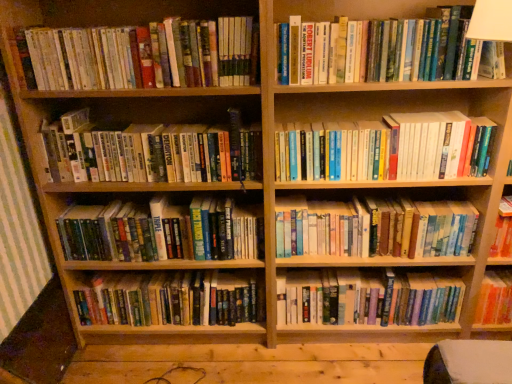
Image resolution: width=512 pixels, height=384 pixels. What do you see at coordinates (378, 50) in the screenshot? I see `hardcover book at upper right, which is counted as the 1th book, starting from the top` at bounding box center [378, 50].

The height and width of the screenshot is (384, 512). I want to click on hardcover books at upper left, which appears as the seventh book when ordered from the bottom, so pos(145,55).

The height and width of the screenshot is (384, 512). Identify the location of hardcover books at left, positioned as the sixth book in bottom-to-top order. (151, 152).

I want to click on hardcover books at center, which appears as the 7th book when viewed from the top, so click(367, 298).

The width and height of the screenshot is (512, 384). I want to click on hardcover book at upper right, which is counted as the 1th book, starting from the top, so click(378, 50).

Is the surface of hardcover books at center, positioned as the eighth book in top-to-bottom order, in direct contact with hardcover books at center, arranged as the 3th book when ordered from the bottom?

No, hardcover books at center, positioned as the eighth book in top-to-bottom order, is not in contact with hardcover books at center, arranged as the 3th book when ordered from the bottom.

Is hardcover books at center, positioned as the eighth book in top-to-bottom order, turned away from hardcover books at center, arranged as the 3th book when ordered from the bottom?

No, hardcover books at center, positioned as the eighth book in top-to-bottom order, is not facing the opposite direction of hardcover books at center, arranged as the 3th book when ordered from the bottom.

From the image's perspective, is hardcover books at center, positioned as the eighth book in top-to-bottom order, positioned above or below hardcover books at center, arranged as the 3th book when ordered from the bottom?

Based on their image positions, hardcover books at center, positioned as the eighth book in top-to-bottom order, is located beneath hardcover books at center, arranged as the 3th book when ordered from the bottom.

How far apart are hardcover books at center, positioned as the eighth book in top-to-bottom order, and hardcover books at center, arranged as the 3th book when ordered from the bottom?

hardcover books at center, positioned as the eighth book in top-to-bottom order, and hardcover books at center, arranged as the 3th book when ordered from the bottom, are 48.60 centimeters apart from each other.

Is point (488, 137) closer to camera compared to point (69, 220)?

Yes.

Is hardcover books at center, positioned as the fourth book in top-to-bottom order, aimed at hardcover book at center, which is the fourth book in bottom-to-top order?

No, hardcover books at center, positioned as the fourth book in top-to-bottom order, is not turned towards hardcover book at center, which is the fourth book in bottom-to-top order.

From a real-world perspective, between hardcover books at center, which appears as the fifth book when ordered from the bottom, and hardcover book at center, which is the fourth book in bottom-to-top order, who is vertically lower?

hardcover book at center, which is the fourth book in bottom-to-top order.

In the image, is hardcover books at center, which appears as the fifth book when ordered from the bottom, positioned in front of or behind hardcover book at center, positioned as the fifth book in top-to-bottom order?

hardcover books at center, which appears as the fifth book when ordered from the bottom, is in front of hardcover book at center, positioned as the fifth book in top-to-bottom order.

Considering the sizes of objects hardcover books at upper right and hardcover books at upper left, which appears as the seventh book when ordered from the bottom, in the image provided, who is thinner, hardcover books at upper right or hardcover books at upper left, which appears as the seventh book when ordered from the bottom,?

hardcover books at upper left, which appears as the seventh book when ordered from the bottom.

Would you say hardcover books at upper left, the second book from the top, is part of hardcover books at upper right's contents?

No, hardcover books at upper left, the second book from the top, is located outside of hardcover books at upper right.

Would you say hardcover books at upper right is a long distance from hardcover books at upper left, the second book from the top?

Result: Actually, hardcover books at upper right and hardcover books at upper left, the second book from the top, are a little close together.

Is hardcover book at upper right, the 8th book when ordered from bottom to top, at the back of hardcover book at center, positioned as the fifth book in top-to-bottom order?

hardcover book at center, positioned as the fifth book in top-to-bottom order, is not turned away from hardcover book at upper right, the 8th book when ordered from bottom to top.

From the image's perspective, relative to hardcover book at upper right, which is counted as the 1th book, starting from the top, is hardcover book at center, which is the fourth book in bottom-to-top order, above or below?

A: hardcover book at center, which is the fourth book in bottom-to-top order, is below hardcover book at upper right, which is counted as the 1th book, starting from the top.

Is hardcover book at center, positioned as the fifth book in top-to-bottom order, wider than hardcover book at upper right, the 8th book when ordered from bottom to top?

Indeed, hardcover book at center, positioned as the fifth book in top-to-bottom order, has a greater width compared to hardcover book at upper right, the 8th book when ordered from bottom to top.

From the image's perspective, between hardcover book at upper right, the 8th book when ordered from bottom to top, and hardcover books at upper right, which one is located above?

hardcover book at upper right, the 8th book when ordered from bottom to top.

From a real-world perspective, who is located higher, hardcover book at upper right, the 8th book when ordered from bottom to top, or hardcover books at upper right?

In real-world perspective, hardcover book at upper right, the 8th book when ordered from bottom to top, is above.

Considering the sizes of objects hardcover book at upper right, the 8th book when ordered from bottom to top, and hardcover books at upper right in the image provided, who is thinner, hardcover book at upper right, the 8th book when ordered from bottom to top, or hardcover books at upper right?

hardcover book at upper right, the 8th book when ordered from bottom to top, is thinner.

Can we say hardcover books at center, which appears as the 7th book when viewed from the top, lies outside hardcover books at center, arranged as the 3th book when ordered from the bottom?

That's correct, hardcover books at center, which appears as the 7th book when viewed from the top, is outside of hardcover books at center, arranged as the 3th book when ordered from the bottom.

Can you tell me how much hardcover books at center, which appears as the 7th book when viewed from the top, and hardcover books at center, arranged as the 3th book when ordered from the bottom, differ in facing direction?

Answer: The angular difference between hardcover books at center, which appears as the 7th book when viewed from the top, and hardcover books at center, arranged as the 3th book when ordered from the bottom, is 9.56e-05 degrees.

How far apart are hardcover books at center, which appears as the 7th book when viewed from the top, and hardcover books at center, arranged as the 3th book when ordered from the bottom?

The distance of hardcover books at center, which appears as the 7th book when viewed from the top, from hardcover books at center, arranged as the 3th book when ordered from the bottom, is 20.92 centimeters.

Consider the image. Could you tell me if hardcover books at center, which appears as the 7th book when viewed from the top, is turned towards hardcover books at center, arranged as the 3th book when ordered from the bottom?

No, hardcover books at center, which appears as the 7th book when viewed from the top, is not facing towards hardcover books at center, arranged as the 3th book when ordered from the bottom.

Is point (153, 244) farther from camera compared to point (385, 105)?

No.

There is a hardcover books at upper right. What are the coordinates of `the 1st book below it (from a real-world perspective)` in the screenshot? It's located at (161, 231).

Considering the relative sizes of hardcover book at center, which is the fourth book in bottom-to-top order, and hardcover books at upper right in the image provided, is hardcover book at center, which is the fourth book in bottom-to-top order, shorter than hardcover books at upper right?

Correct, hardcover book at center, which is the fourth book in bottom-to-top order, is not as tall as hardcover books at upper right.

From a real-world perspective, starting from the hardcover books at center, arranged as the 3th book when ordered from the bottom, which book is the 2nd one below it? Please provide its 2D coordinates.

[(172, 299)]

There is a hardcover book at center, positioned as the fifth book in top-to-bottom order. Where is `the 1st book above it (from the image's perspective)`? Image resolution: width=512 pixels, height=384 pixels. the 1st book above it (from the image's perspective) is located at coordinates (387, 148).

Based on their spatial positions, is hardcover books at upper right or hardcover books at center, the first book from the bottom, further from hardcover books at center, positioned as the fourth book in top-to-bottom order?

hardcover books at center, the first book from the bottom, is positioned further to the anchor hardcover books at center, positioned as the fourth book in top-to-bottom order.

Considering their positions, is hardcover books at left, the 3th book positioned from the top, positioned closer to hardcover books at upper left, which appears as the seventh book when ordered from the bottom, than hardcover books at center, positioned as the fourth book in top-to-bottom order?

hardcover books at left, the 3th book positioned from the top, is positioned closer to the anchor hardcover books at upper left, which appears as the seventh book when ordered from the bottom.

Estimate the real-world distances between objects in this image. Which object is further from hardcover books at upper right, hardcover books at left, the 3th book positioned from the top, or hardcover books at center, positioned as the fourth book in top-to-bottom order?

Among the two, hardcover books at left, the 3th book positioned from the top, is located further to hardcover books at upper right.

Looking at the image, which one is located closer to hardcover books at center, the 2th book positioned from the bottom, hardcover books at center, the first book from the bottom, or hardcover books at upper left, which appears as the seventh book when ordered from the bottom?

The object closer to hardcover books at center, the 2th book positioned from the bottom, is hardcover books at center, the first book from the bottom.

Estimate the real-world distances between objects in this image. Which object is closer to hardcover books at left, the 3th book positioned from the top, hardcover books at center, arranged as the 3th book when ordered from the bottom, or hardcover books at center, which appears as the 7th book when viewed from the top?

The object closer to hardcover books at left, the 3th book positioned from the top, is hardcover books at center, arranged as the 3th book when ordered from the bottom.

Considering their positions, is hardcover books at center, the 2th book positioned from the bottom, positioned further to hardcover books at upper right than hardcover books at upper left, which appears as the seventh book when ordered from the bottom?

hardcover books at upper left, which appears as the seventh book when ordered from the bottom, is positioned further to the anchor hardcover books at upper right.

Estimate the real-world distances between objects in this image. Which object is further from hardcover book at center, which is the fourth book in bottom-to-top order, hardcover books at upper right or hardcover books at center, positioned as the 6th book in top-to-bottom order?

hardcover books at upper right is further to hardcover book at center, which is the fourth book in bottom-to-top order.

Looking at the image, which one is located closer to hardcover book at upper right, which is counted as the 1th book, starting from the top, hardcover books at upper left, the second book from the top, or hardcover books at center, which appears as the fifth book when ordered from the bottom?

hardcover books at center, which appears as the fifth book when ordered from the bottom.